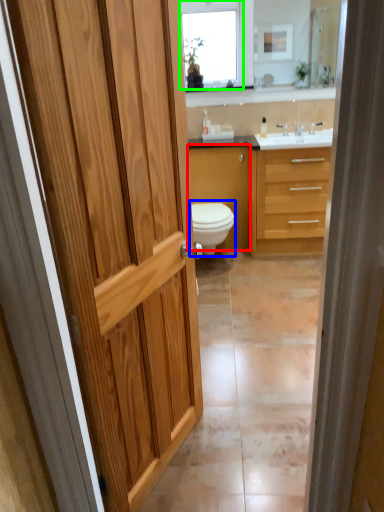
Question: Based on their relative distances, which object is nearer to cabinetry (highlighted by a red box)? Choose from toilet (highlighted by a blue box) and window (highlighted by a green box).

Choices:
 (A) toilet
 (B) window

Answer: (A)